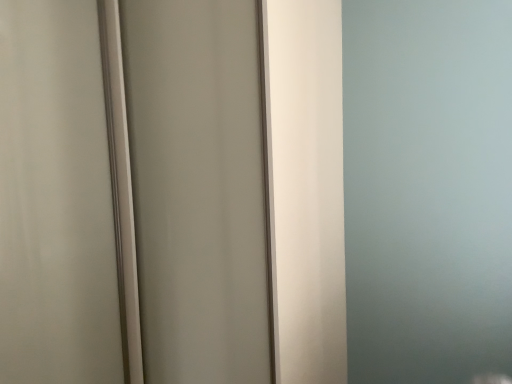
Question: Which direction should I rotate to face matte white screen door at center, which is counted as the second screen door, starting from the left, — up or down?

Choices:
 (A) down
 (B) up

Answer: (A)

Question: Considering the relative sizes of white glossy screen door at center, which is counted as the second screen door, starting from the right, and matte white screen door at center, marked as the first screen door in a right-to-left arrangement, in the image provided, is white glossy screen door at center, which is counted as the second screen door, starting from the right, smaller than matte white screen door at center, marked as the first screen door in a right-to-left arrangement,?

Choices:
 (A) yes
 (B) no

Answer: (A)

Question: Could you tell me if white glossy screen door at center, which is counted as the second screen door, starting from the right, is turned towards matte white screen door at center, which is counted as the second screen door, starting from the left?

Choices:
 (A) yes
 (B) no

Answer: (B)

Question: Is white glossy screen door at center, which is counted as the second screen door, starting from the right, not within matte white screen door at center, marked as the first screen door in a right-to-left arrangement?

Choices:
 (A) yes
 (B) no

Answer: (A)

Question: Considering the relative sizes of white glossy screen door at center, which is counted as the second screen door, starting from the right, and matte white screen door at center, which is counted as the second screen door, starting from the left, in the image provided, is white glossy screen door at center, which is counted as the second screen door, starting from the right, thinner than matte white screen door at center, which is counted as the second screen door, starting from the left,?

Choices:
 (A) no
 (B) yes

Answer: (A)

Question: Can you confirm if white glossy screen door at center, which is counted as the second screen door, starting from the right, is positioned to the right of matte white screen door at center, which is counted as the second screen door, starting from the left?

Choices:
 (A) no
 (B) yes

Answer: (A)

Question: From the image's perspective, would you say white glossy screen door at center, which ranks as the first screen door in left-to-right order, is shown under matte white screen door at center, which is counted as the second screen door, starting from the left?

Choices:
 (A) no
 (B) yes

Answer: (B)

Question: Are matte white screen door at center, marked as the first screen door in a right-to-left arrangement, and white glossy screen door at center, which ranks as the first screen door in left-to-right order, far apart?

Choices:
 (A) no
 (B) yes

Answer: (A)

Question: From a real-world perspective, is matte white screen door at center, which is counted as the second screen door, starting from the left, under white glossy screen door at center, which is counted as the second screen door, starting from the right?

Choices:
 (A) no
 (B) yes

Answer: (B)

Question: From a real-world perspective, does matte white screen door at center, which is counted as the second screen door, starting from the left, stand above white glossy screen door at center, which is counted as the second screen door, starting from the right?

Choices:
 (A) yes
 (B) no

Answer: (B)

Question: Does matte white screen door at center, marked as the first screen door in a right-to-left arrangement, have a lesser height compared to white glossy screen door at center, which ranks as the first screen door in left-to-right order?

Choices:
 (A) no
 (B) yes

Answer: (A)

Question: Is matte white screen door at center, marked as the first screen door in a right-to-left arrangement, to the right of white glossy screen door at center, which is counted as the second screen door, starting from the right, from the viewer's perspective?

Choices:
 (A) yes
 (B) no

Answer: (A)

Question: Does matte white screen door at center, marked as the first screen door in a right-to-left arrangement, have a lesser width compared to white glossy screen door at center, which is counted as the second screen door, starting from the right?

Choices:
 (A) no
 (B) yes

Answer: (B)

Question: Looking at the image, does white glossy screen door at center, which ranks as the first screen door in left-to-right order, seem bigger or smaller compared to matte white screen door at center, which is counted as the second screen door, starting from the left?

Choices:
 (A) big
 (B) small

Answer: (B)